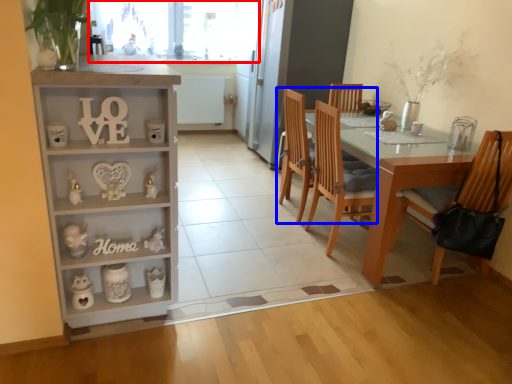
Question: Which object appears closest to the camera in this image, window screen (highlighted by a red box) or chair (highlighted by a blue box)?

Choices:
 (A) window screen
 (B) chair

Answer: (B)